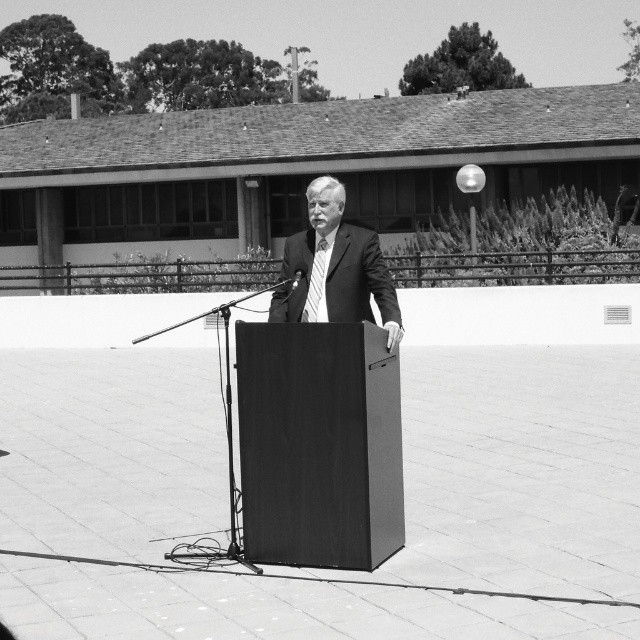
You are an event organizer trying to set up a stage for a speaker. The stage has limited space between the left and right edges. You have the smooth black podium at center and the smooth suit at center. Based on their sizes, which one should you place closer to the edge to save space?

The smooth suit at center is smaller in width than the smooth black podium at center, so placing the smooth suit at center closer to the edge would save more space.

You are an event planner setting up a stage for a speaker. You see the smooth black podium at center and the smooth suit at center in the image. Which object is positioned to the left of the other?

The smooth black podium at center is to the left of the smooth suit at center.